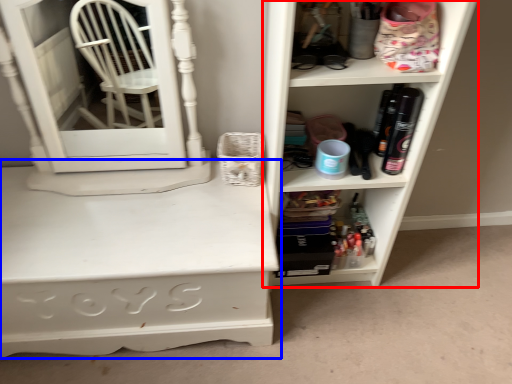
Question: Among these objects, which one is farthest to the camera, shelf (highlighted by a red box) or desk (highlighted by a blue box)?

Choices:
 (A) shelf
 (B) desk

Answer: (B)